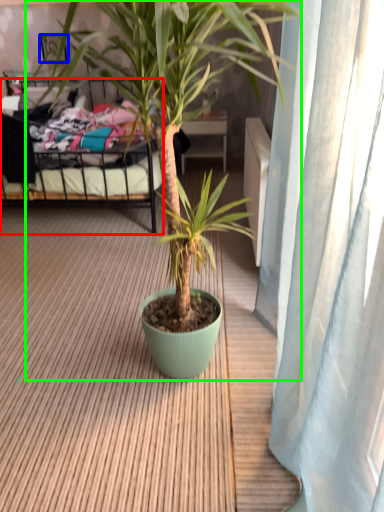
Question: Which is nearer to the bed (highlighted by a red box)? picture frame (highlighted by a blue box) or houseplant (highlighted by a green box).

Choices:
 (A) picture frame
 (B) houseplant

Answer: (A)